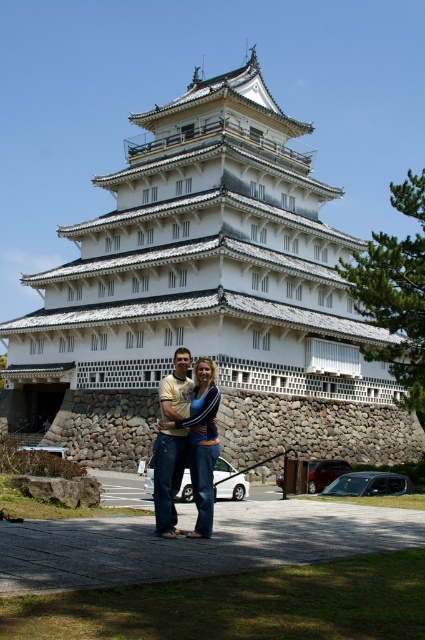
Question: Is white wooden palace at center to the right of denim jeans at center from the viewer's perspective?

Choices:
 (A) yes
 (B) no

Answer: (A)

Question: Which object appears closest to the camera in this image?

Choices:
 (A) denim jeans at center
 (B) white wooden palace at center

Answer: (A)

Question: Observing the image, what is the correct spatial positioning of white wooden palace at center in reference to denim jeans at center?

Choices:
 (A) above
 (B) below

Answer: (A)

Question: Is white wooden palace at center thinner than denim jeans at center?

Choices:
 (A) yes
 (B) no

Answer: (B)

Question: Which object is farther from the camera taking this photo?

Choices:
 (A) denim jeans at center
 (B) white wooden palace at center

Answer: (B)